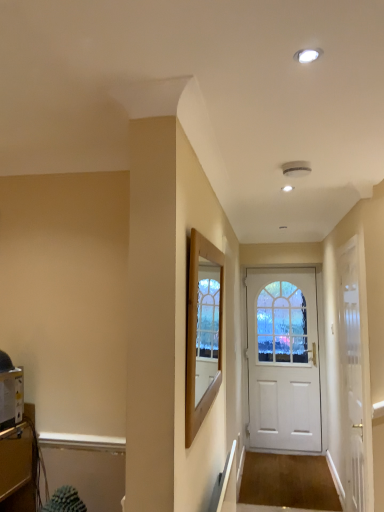
Question: Is there a large distance between white glossy door at center, which is the 2th door from back to front, and white matte door at center, the second door from the front?

Choices:
 (A) yes
 (B) no

Answer: (A)

Question: Is white glossy door at center, acting as the 1th door starting from the front, taller than white matte door at center, the second door from the front?

Choices:
 (A) yes
 (B) no

Answer: (B)

Question: Is white glossy door at center, which is the 2th door from back to front, positioned with its back to white matte door at center, marked as the first door in a back-to-front arrangement?

Choices:
 (A) yes
 (B) no

Answer: (B)

Question: From the image's perspective, is white glossy door at center, acting as the 1th door starting from the front, on white matte door at center, the second door from the front?

Choices:
 (A) no
 (B) yes

Answer: (B)

Question: Is white glossy door at center, acting as the 1th door starting from the front, surrounding white matte door at center, marked as the first door in a back-to-front arrangement?

Choices:
 (A) yes
 (B) no

Answer: (B)

Question: Is the position of white glossy door at center, acting as the 1th door starting from the front, more distant than that of white matte door at center, the second door from the front?

Choices:
 (A) yes
 (B) no

Answer: (B)

Question: Is white glossy door at center, which is the 2th door from back to front, smaller than wooden frame at center?

Choices:
 (A) yes
 (B) no

Answer: (B)

Question: From a real-world perspective, is white glossy door at center, which is the 2th door from back to front, physically below wooden frame at center?

Choices:
 (A) no
 (B) yes

Answer: (B)

Question: Is white glossy door at center, acting as the 1th door starting from the front, positioned beyond the bounds of wooden frame at center?

Choices:
 (A) no
 (B) yes

Answer: (B)

Question: Is white glossy door at center, which is the 2th door from back to front, beside wooden frame at center?

Choices:
 (A) no
 (B) yes

Answer: (A)

Question: Is white glossy door at center, acting as the 1th door starting from the front, positioned far away from wooden frame at center?

Choices:
 (A) no
 (B) yes

Answer: (B)

Question: Can you confirm if white glossy door at center, acting as the 1th door starting from the front, is positioned to the right of wooden frame at center?

Choices:
 (A) yes
 (B) no

Answer: (A)

Question: Does wooden frame at center touch white glossy door at center, which is the 2th door from back to front?

Choices:
 (A) no
 (B) yes

Answer: (A)